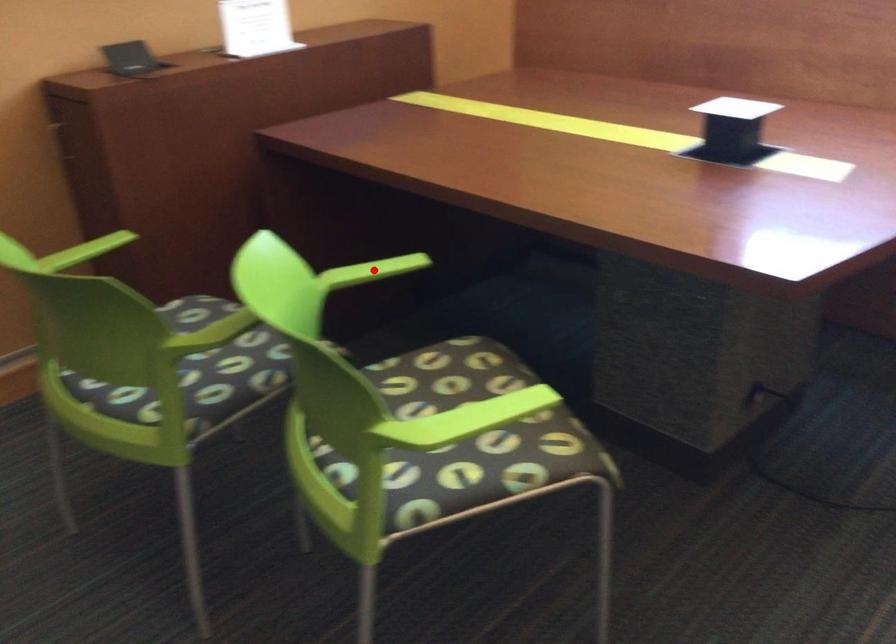
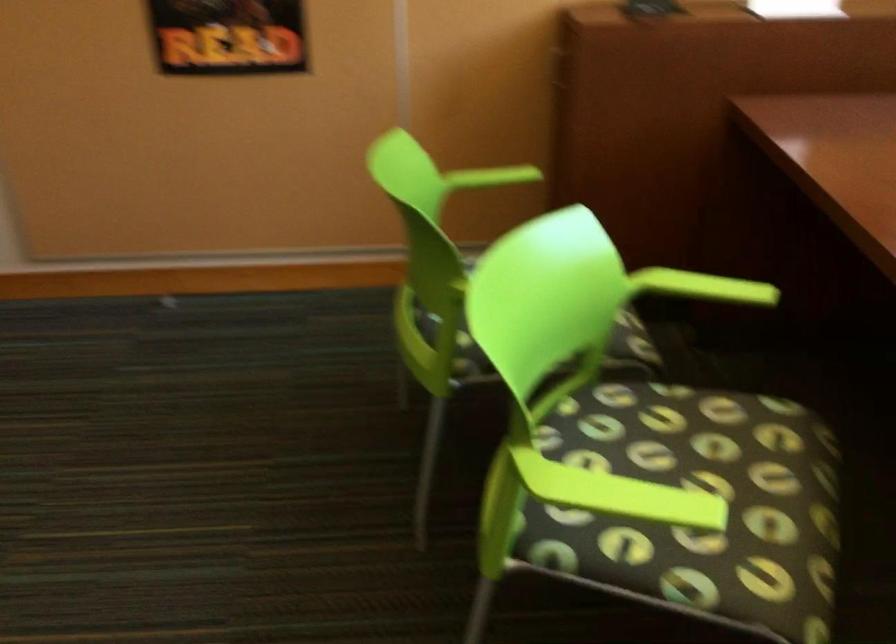
Question: I am providing you with two images of the same scene from different viewpoints. Image1 has a red point marked. In image2, the corresponding 3D location appears at what relative position? Reply with the corresponding letter.

Choices:
 (A) Closer
 (B) Farther

Answer: (A)